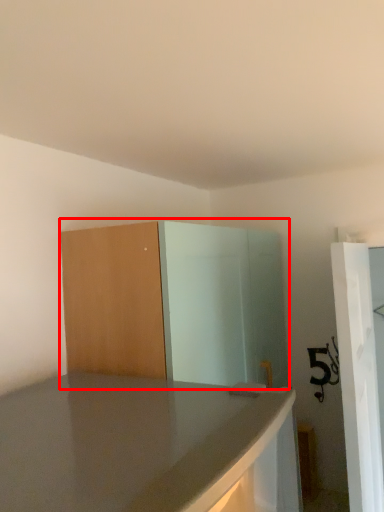
Question: From the image's perspective, where is dresser (annotated by the red box) located relative to screen door?

Choices:
 (A) above
 (B) below

Answer: (A)